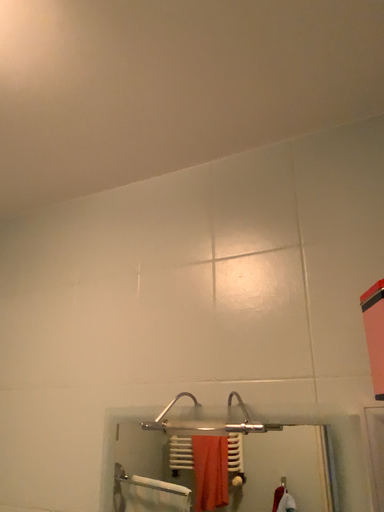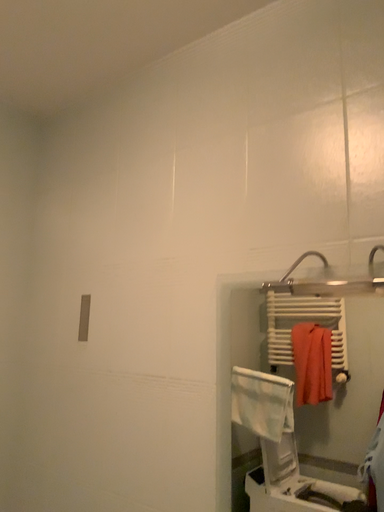
Question: Which way did the camera rotate in the video?

Choices:
 (A) rotated upward
 (B) rotated downward

Answer: (B)